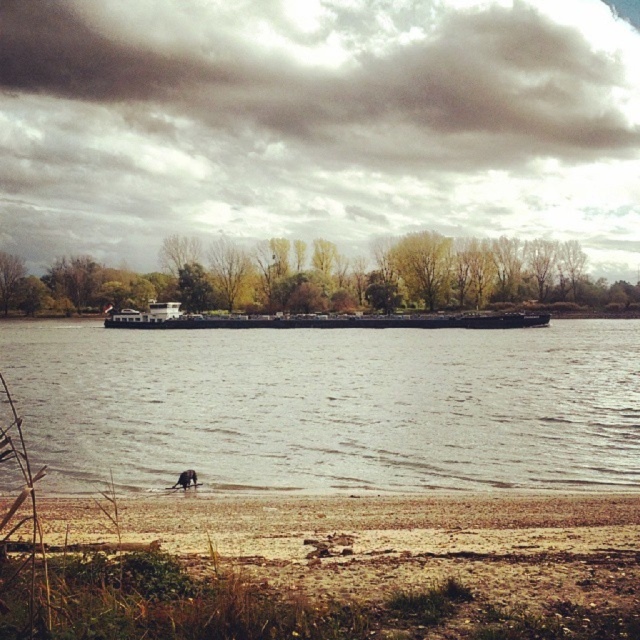
Is point (4, 636) farther from camera compared to point (106, 326)?

No, it is in front of (106, 326).

This screenshot has height=640, width=640. What are the coordinates of `brown sand at lower center` in the screenshot? It's located at (326, 570).

Consider the image. Can you confirm if gray metallic barge at center is positioned below brown sand at lower center?

Incorrect, gray metallic barge at center is not positioned below brown sand at lower center.

The width and height of the screenshot is (640, 640). What do you see at coordinates (332, 404) in the screenshot? I see `gray metallic barge at center` at bounding box center [332, 404].

Where is `gray metallic barge at center`? This screenshot has width=640, height=640. gray metallic barge at center is located at coordinates (332, 404).

Can you confirm if gray metallic barge at center is bigger than dark gray metallic barge at center?

Correct, gray metallic barge at center is larger in size than dark gray metallic barge at center.

Describe the element at coordinates (332, 404) in the screenshot. The image size is (640, 640). I see `gray metallic barge at center` at that location.

Between point (444, 448) and point (397, 317), which one is positioned behind?

Point (397, 317)

The width and height of the screenshot is (640, 640). I want to click on gray metallic barge at center, so click(x=332, y=404).